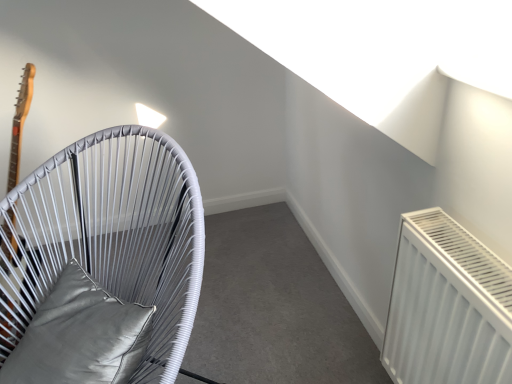
Question: Considering the positions of satin gray pillow at left and white woven chair at left in the image, is satin gray pillow at left wider or thinner than white woven chair at left?

Choices:
 (A) thin
 (B) wide

Answer: (A)

Question: In terms of height, does satin gray pillow at left look taller or shorter compared to white woven chair at left?

Choices:
 (A) short
 (B) tall

Answer: (A)

Question: Is satin gray pillow at left inside or outside of white woven chair at left?

Choices:
 (A) outside
 (B) inside

Answer: (B)

Question: Is white woven chair at left bigger or smaller than satin gray pillow at left?

Choices:
 (A) big
 (B) small

Answer: (A)

Question: Is point (47, 258) closer or farther from the camera than point (119, 306)?

Choices:
 (A) farther
 (B) closer

Answer: (A)

Question: From a real-world perspective, is white woven chair at left above or below satin gray pillow at left?

Choices:
 (A) above
 (B) below

Answer: (B)

Question: Based on their positions, is white woven chair at left located to the left or right of satin gray pillow at left?

Choices:
 (A) right
 (B) left

Answer: (B)